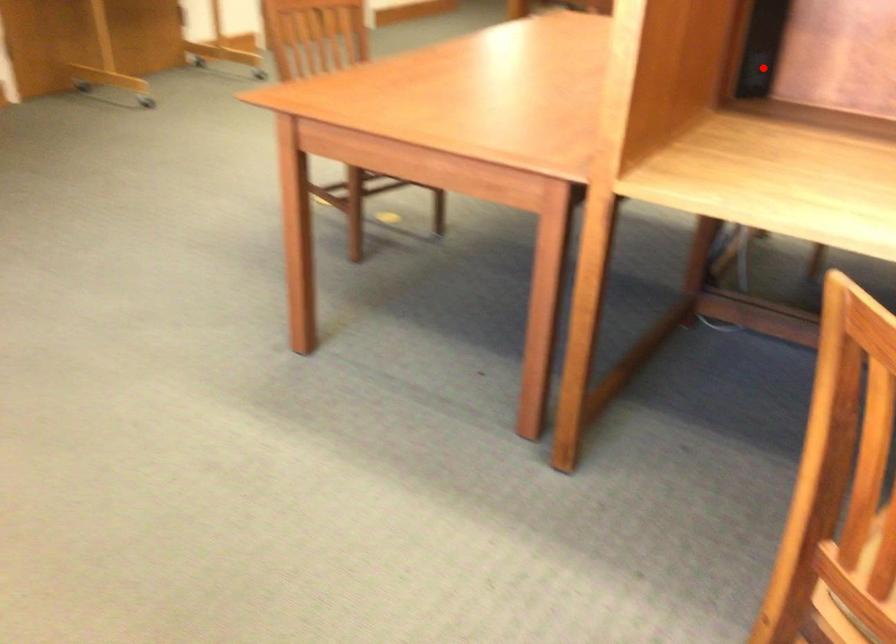
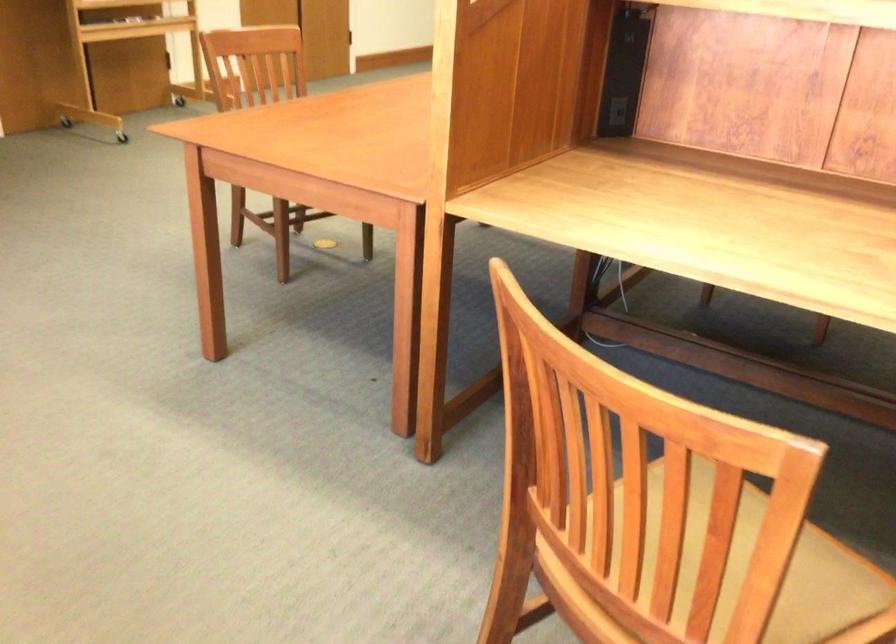
Question: I am providing you with two images of the same scene from different viewpoints. In image1, a red point is highlighted. Considering the same 3D point in image2, which of the following is correct?

Choices:
 (A) It is closer
 (B) It is farther

Answer: (B)